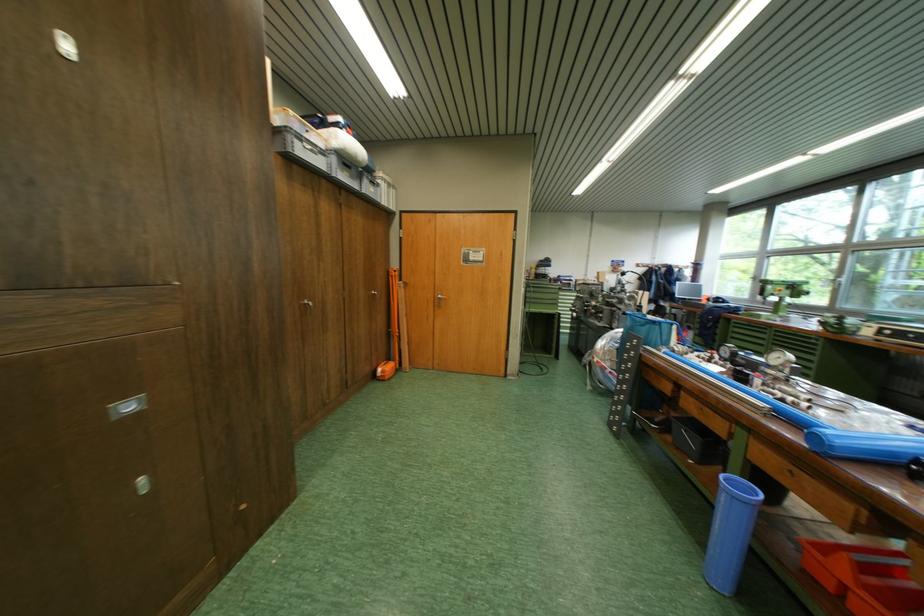
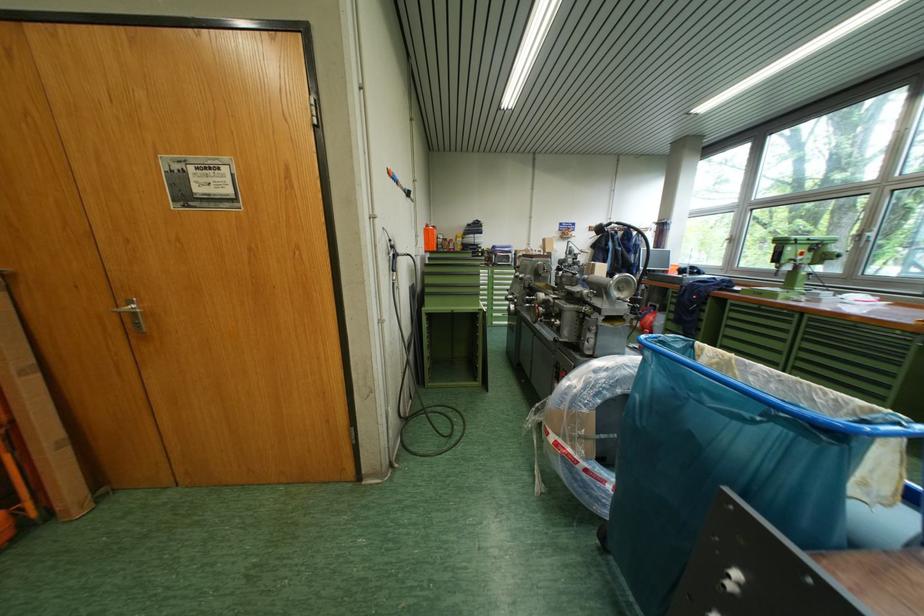
The images are taken continuously from a first-person perspective. In which direction are you moving?

The cameraman moved toward right, forward.